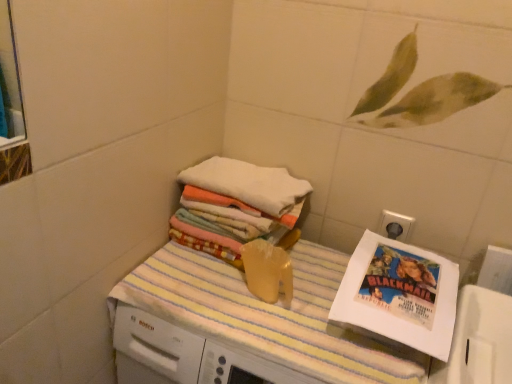
The image size is (512, 384). In order to click on free space above white soft towels at upper center (from a real-world perspective) in this screenshot , I will do `click(232, 172)`.